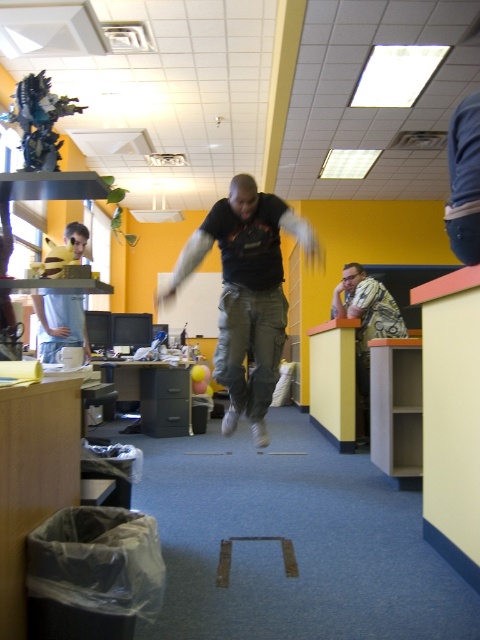
Question: Which of the following is the farthest from the observer?

Choices:
 (A) blue denim jeans at upper right
 (B) printed fabric shirt at right
 (C) matte black shirt at upper left
 (D) black matte shirt at center

Answer: (B)

Question: Is black matte shirt at center thinner than matte black shirt at upper left?

Choices:
 (A) yes
 (B) no

Answer: (B)

Question: Considering the relative positions of printed fabric shirt at right and matte black shirt at upper left in the image provided, where is printed fabric shirt at right located with respect to matte black shirt at upper left?

Choices:
 (A) below
 (B) above

Answer: (A)

Question: Among these objects, which one is farthest from the camera?

Choices:
 (A) blue denim jeans at upper right
 (B) printed fabric shirt at right
 (C) matte black shirt at upper left
 (D) black matte shirt at center

Answer: (B)

Question: Can you confirm if printed fabric shirt at right is positioned below matte black shirt at upper left?

Choices:
 (A) no
 (B) yes

Answer: (B)

Question: Which point appears closest to the camera in this image?

Choices:
 (A) (334, 301)
 (B) (268, 317)
 (C) (478, 113)

Answer: (C)